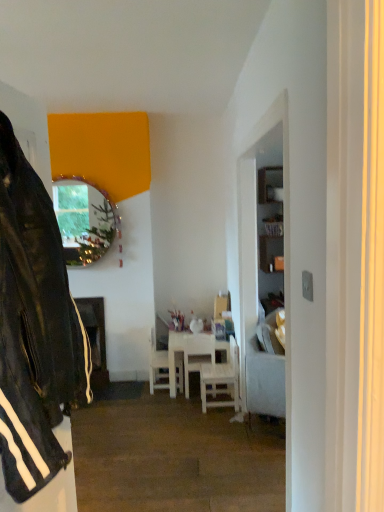
Where is `vacant space in front of white wooden table at center`? This screenshot has height=512, width=384. vacant space in front of white wooden table at center is located at coordinates (171, 414).